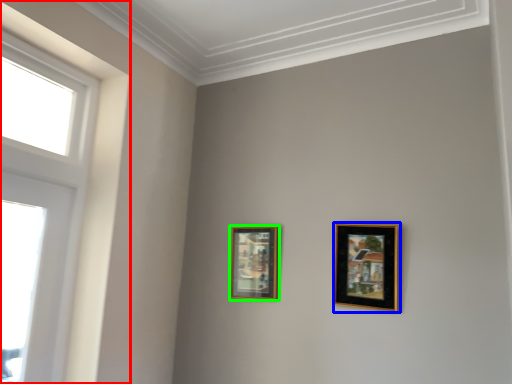
Question: Which is farther away from window (highlighted by a red box)? picture frame (highlighted by a blue box) or picture frame (highlighted by a green box)?

Choices:
 (A) picture frame
 (B) picture frame

Answer: (A)